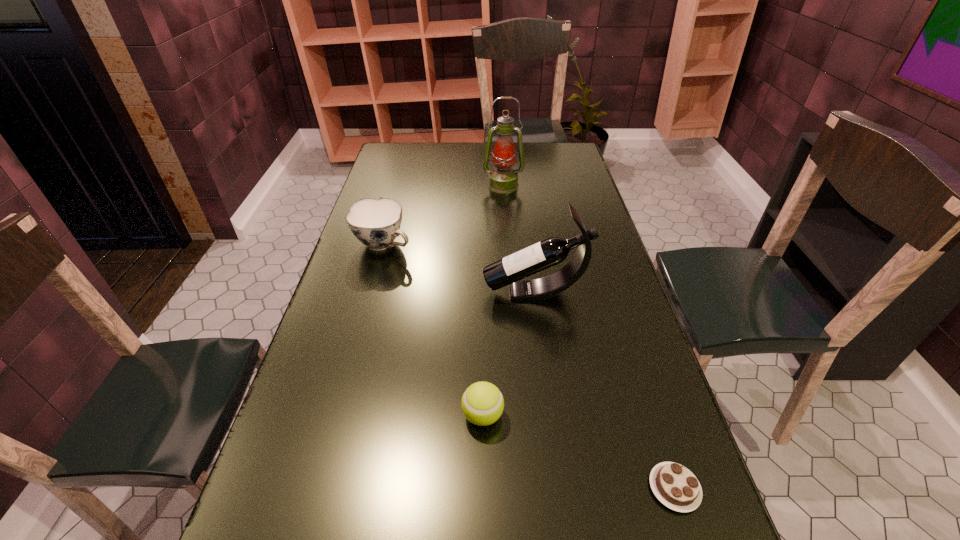
Image resolution: width=960 pixels, height=540 pixels. Find the location of `free space located 0.290m on the front of the oil lamp`. free space located 0.290m on the front of the oil lamp is located at coordinates (508, 240).

Where is `vacant area situated 0.090m on the stand of the third farthest object`? vacant area situated 0.090m on the stand of the third farthest object is located at coordinates (450, 292).

I want to click on vacant space located 0.130m on the stand of the third farthest object, so click(435, 292).

You are a GUI agent. You are given a task and a screenshot of the screen. Output one action in this format:
    pyautogui.click(x=<x>, y=<y>)
    Task: Click on the vacant space located 0.260m on the stand of the third farthest object
    
    Given the screenshot: What is the action you would take?
    pyautogui.click(x=388, y=292)

Where is `vacant region located on the front of the third shortest object`? vacant region located on the front of the third shortest object is located at coordinates (364, 318).

The height and width of the screenshot is (540, 960). What are the coordinates of `free space located on the back of the fourth farthest object` in the screenshot? It's located at (482, 372).

In order to click on blank space located on the back of the rightmost object in this screenshot , I will do `click(633, 361)`.

Identify the location of object at the left edge. The height and width of the screenshot is (540, 960). (376, 223).

You are a GUI agent. You are given a task and a screenshot of the screen. Output one action in this format:
    pyautogui.click(x=<x>, y=<y>)
    Task: Click on the wine bottle positioned at the right edge
    
    Given the screenshot: What is the action you would take?
    pyautogui.click(x=509, y=270)

At what (x,y) coordinates should I click in order to perform the action: click on chocolate cake that is at the right edge. Please return your answer as a coordinate pair (x, y). The image size is (960, 540). Looking at the image, I should click on (675, 486).